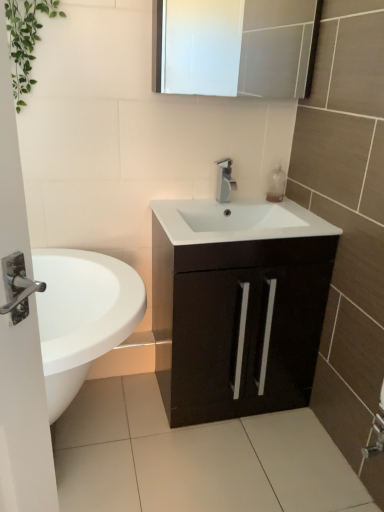
Find the location of a particular element. Image resolution: width=384 pixels, height=512 pixels. blank area to the left of silver metallic faucet at center is located at coordinates (196, 203).